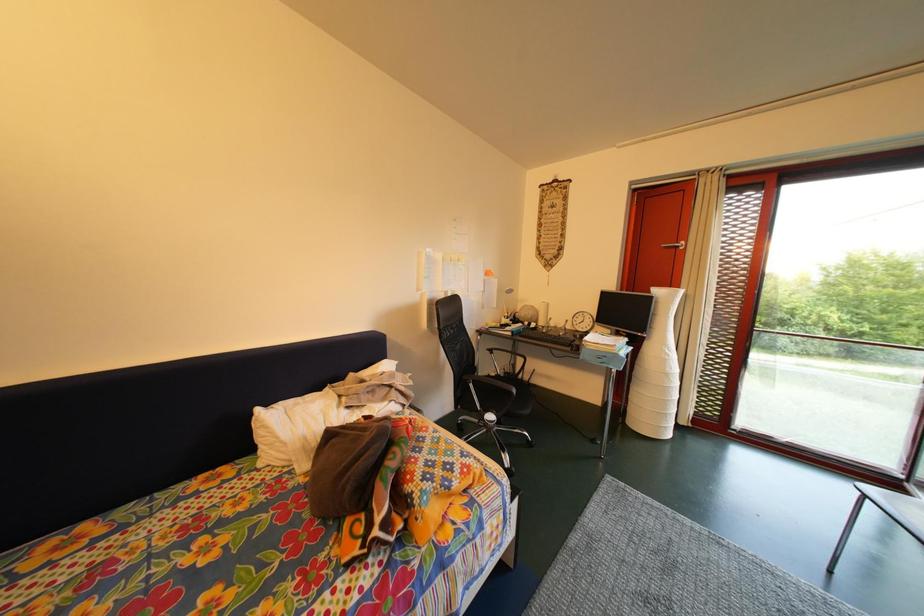
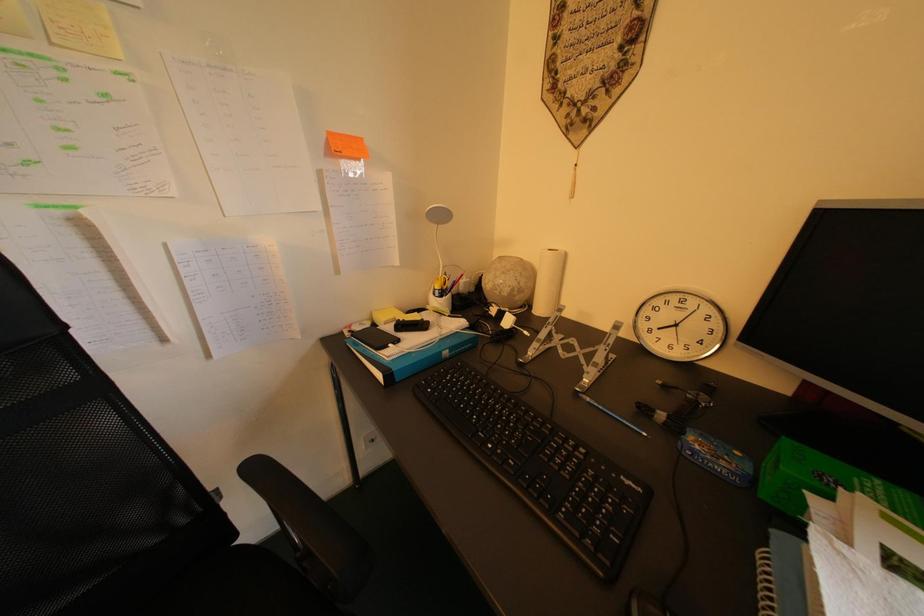
The images are taken continuously from a first-person perspective. In which direction are you moving?

The movement direction of the cameraman is right, forward.